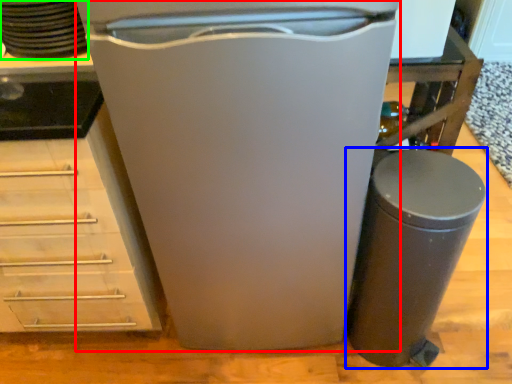
Question: Which object is the farthest from home appliance (highlighted by a red box)? Choose among these: waste container (highlighted by a blue box) or appliance (highlighted by a green box).

Choices:
 (A) waste container
 (B) appliance

Answer: (B)